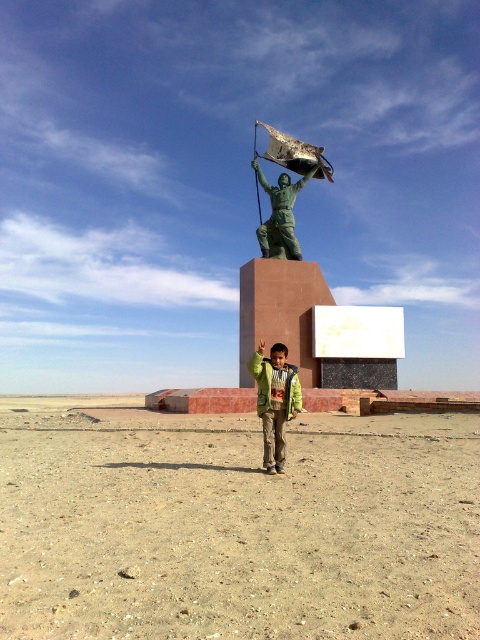
Question: Can you confirm if bronze statue at center is positioned below green matte jacket at center?

Choices:
 (A) yes
 (B) no

Answer: (B)

Question: Among these points, which one is farthest from the camera?

Choices:
 (A) (297, 170)
 (B) (283, 456)

Answer: (A)

Question: Which of the following is the farthest from the observer?

Choices:
 (A) (267, 628)
 (B) (276, 132)

Answer: (B)

Question: Estimate the real-world distances between objects in this image. Which object is farther from the bronze statue at center?

Choices:
 (A) green matte jacket at center
 (B) dull brown dirt at center

Answer: (A)

Question: Can you confirm if bronze statue at center is smaller than green matte jacket at center?

Choices:
 (A) yes
 (B) no

Answer: (B)

Question: From the image, what is the correct spatial relationship of dull brown dirt at center in relation to green matte jacket at center?

Choices:
 (A) right
 (B) left

Answer: (B)